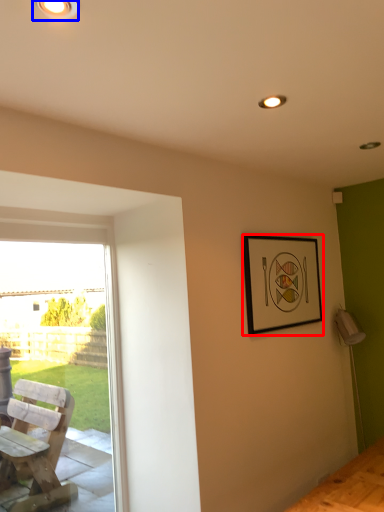
Question: Which object appears farthest to the camera in this image, picture frame (highlighted by a red box) or light fixture (highlighted by a blue box)?

Choices:
 (A) picture frame
 (B) light fixture

Answer: (A)